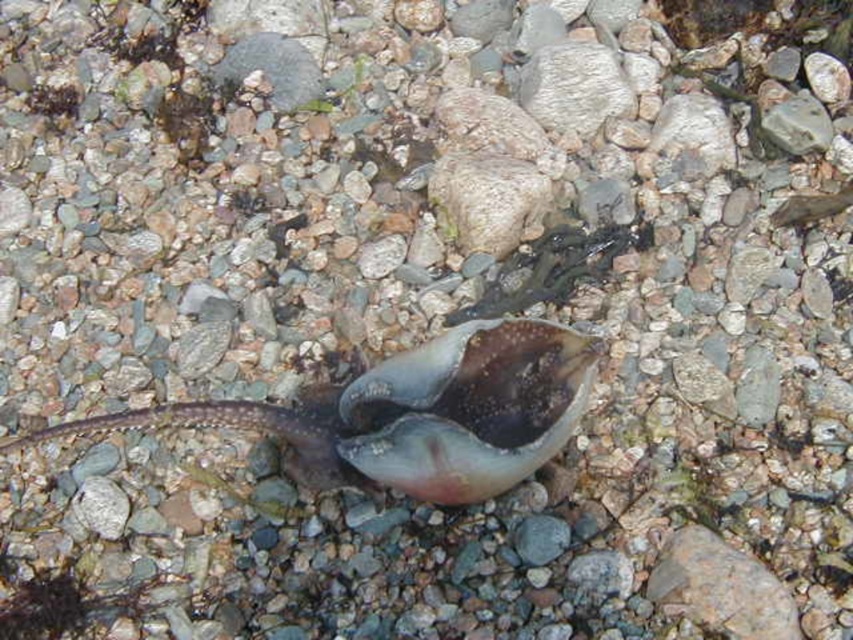
You are standing on the rocky beach and see the translucent rubber snail at center and the smooth gray rock at center. Which object is closer to you?

The translucent rubber snail at center is closer to you because it is in front of the smooth gray rock at center.

You are standing on the rocky beach and see a point marked at coordinates (418, 412). What object is located at that point?

The point at (418, 412) corresponds to the translucent rubber snail at center.

You are a marine biologist examining the rocky beach. You notice the translucent rubber snail at center and the smooth gray rock at center. Which object is positioned to the right of the other?

The translucent rubber snail at center is to the right of the smooth gray rock at center.